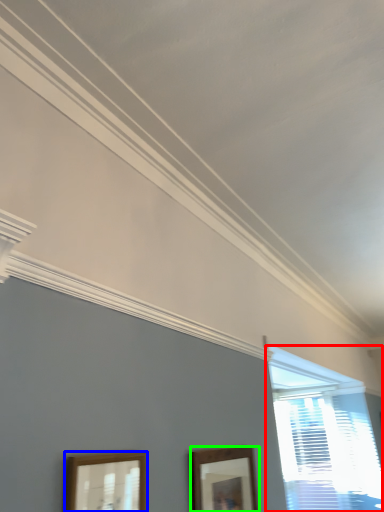
Question: Estimate the real-world distances between objects in this image. Which object is farther from window (highlighted by a red box), picture frame (highlighted by a blue box) or picture frame (highlighted by a green box)?

Choices:
 (A) picture frame
 (B) picture frame

Answer: (A)